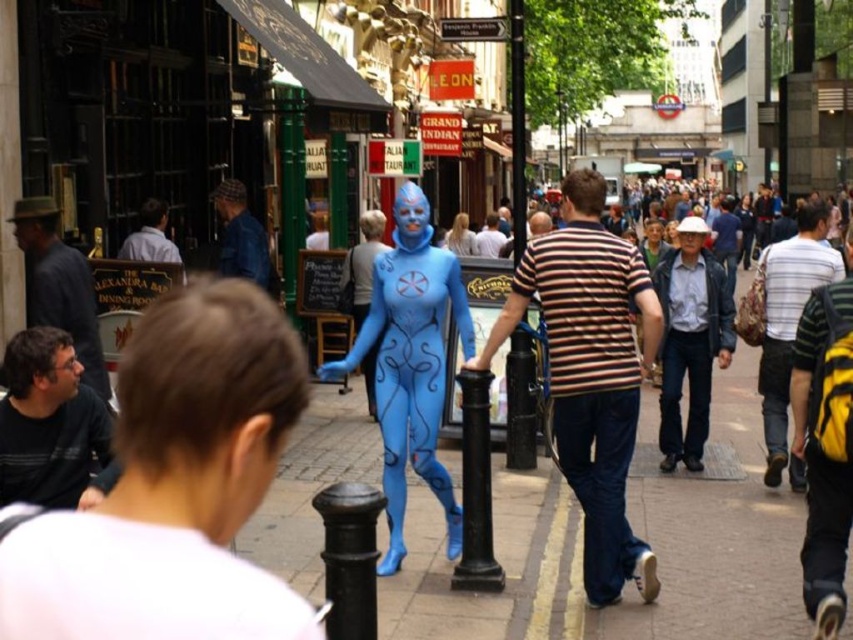
Question: Which of the following is the farthest from the observer?

Choices:
 (A) black metal pole at center
 (B) dark gray shirt at left
 (C) matte white face at center
 (D) dark gray striped shirt at lower left

Answer: (C)

Question: Can you confirm if blue matte face at center is positioned below matte white face at center?

Choices:
 (A) no
 (B) yes

Answer: (A)

Question: Where is black metal pole at center located in relation to blue matte face at center in the image?

Choices:
 (A) below
 (B) above

Answer: (B)

Question: Does black cast iron pole at center lie behind matte black face at lower left?

Choices:
 (A) no
 (B) yes

Answer: (A)

Question: Among these points, which one is farthest from the camera?

Choices:
 (A) (415, 289)
 (B) (595, 556)

Answer: (A)

Question: Which object is positioned closest to the dark gray striped shirt at lower left?

Choices:
 (A) denim jacket at center
 (B) matte black face at lower left
 (C) black metal pole at center

Answer: (B)